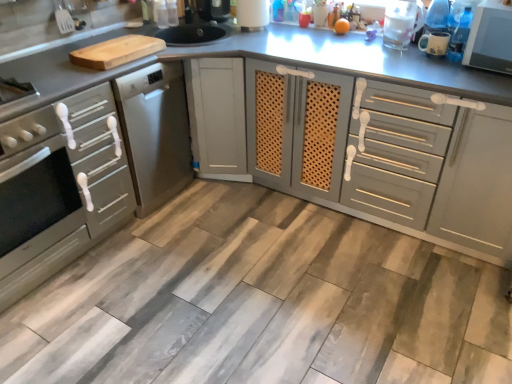
Find the location of a particular element. free area below white textured paper towel holder at upper center, the 3th appliance in the right-to-left sequence (from a real-world perspective) is located at coordinates (256, 28).